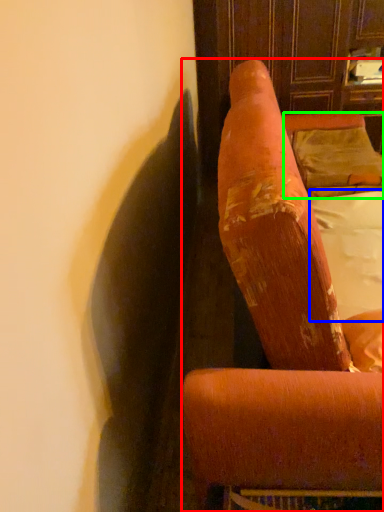
Question: Which is nearer to the furniture (highlighted by a red box)? sheet (highlighted by a blue box) or pillow (highlighted by a green box).

Choices:
 (A) sheet
 (B) pillow

Answer: (A)